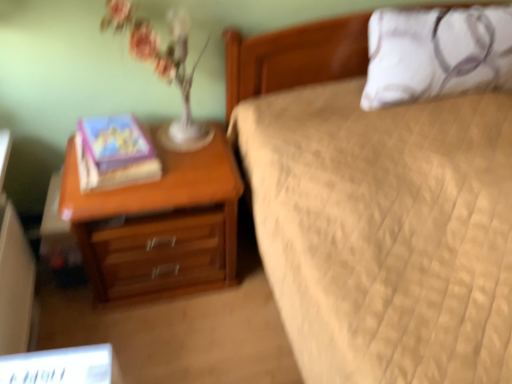
At what (x,y) coordinates should I click in order to perform the action: click on vacant space to the right of matte purple book at left. Please return your answer as a coordinate pair (x, y). This screenshot has width=512, height=384. Looking at the image, I should click on (191, 162).